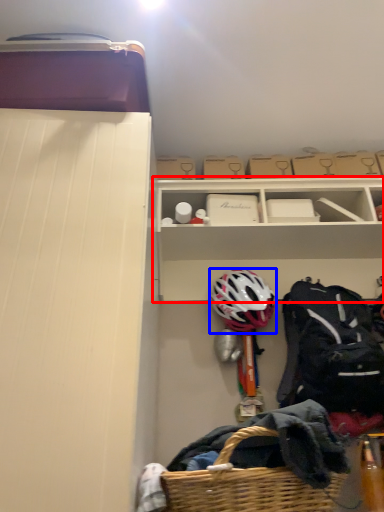
Question: Which of the following is the farthest to the observer, shelf (highlighted by a red box) or helmet (highlighted by a blue box)?

Choices:
 (A) shelf
 (B) helmet

Answer: (A)